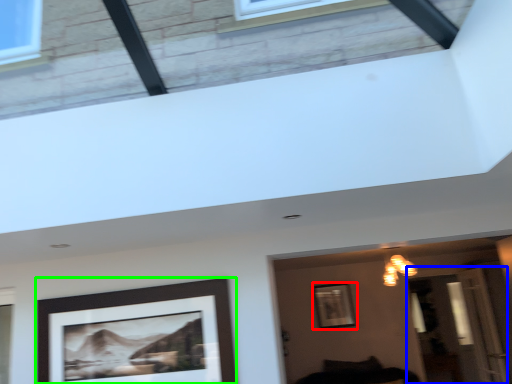
Question: Based on their relative distances, which object is nearer to picture frame (highlighted by a red box)? Choose from glass door (highlighted by a blue box) and picture frame (highlighted by a green box).

Choices:
 (A) glass door
 (B) picture frame

Answer: (A)